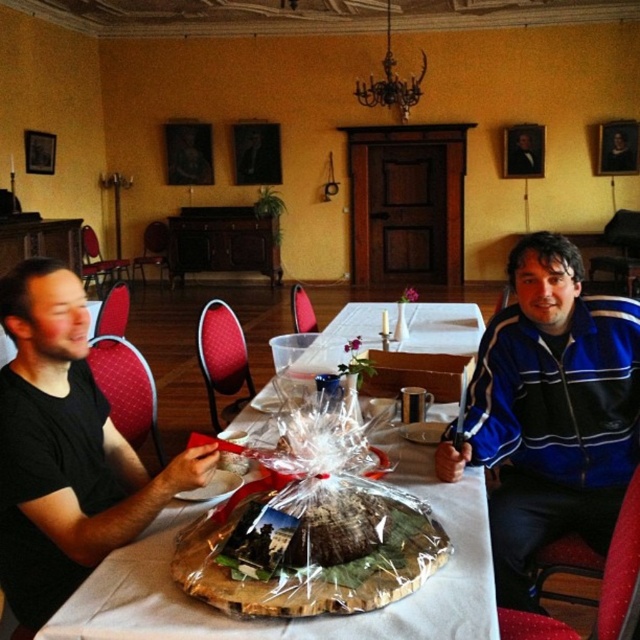
Is black matte shirt at left smaller than translucent plastic table at center?

Yes.

Who is more forward, (x=33, y=385) or (x=237, y=429)?

Point (x=33, y=385)

Locate an element on the screen. This screenshot has height=640, width=640. black matte shirt at left is located at coordinates (65, 449).

Who is more distant from viewer, (552, 436) or (54, 518)?

The point (552, 436) is more distant.

Can you confirm if blue striped jacket at right is shorter than black matte shirt at left?

No, blue striped jacket at right is not shorter than black matte shirt at left.

The image size is (640, 640). Find the location of `blue striped jacket at right`. blue striped jacket at right is located at coordinates (550, 412).

Find the location of a particular element. blue striped jacket at right is located at coordinates (550, 412).

Is point (616, 332) in front of point (269, 579)?

No, it is behind (269, 579).

Is blue striped jacket at right smaller than translucent plastic cake at center?

Incorrect, blue striped jacket at right is not smaller in size than translucent plastic cake at center.

Does point (605, 404) come farther from viewer compared to point (332, 592)?

That is True.

Where is `blue striped jacket at right`? The width and height of the screenshot is (640, 640). blue striped jacket at right is located at coordinates (550, 412).